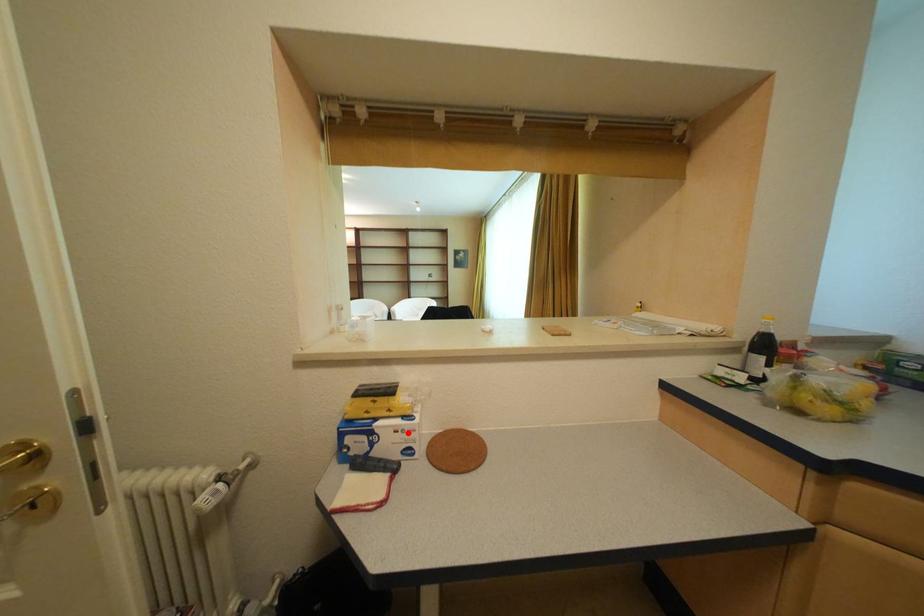
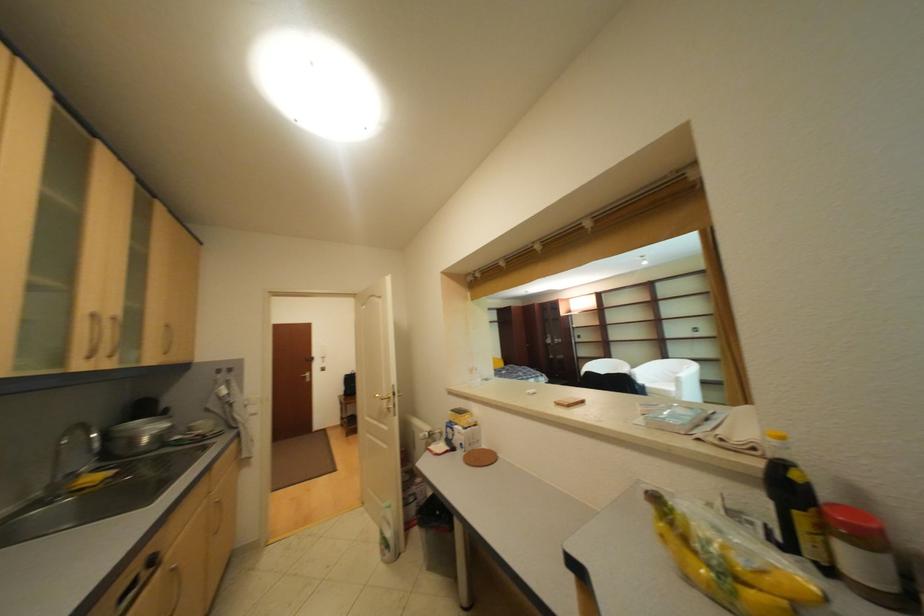
The point at the highlighted location is marked in the first image. Where is the corresponding point in the second image?

(469, 434)